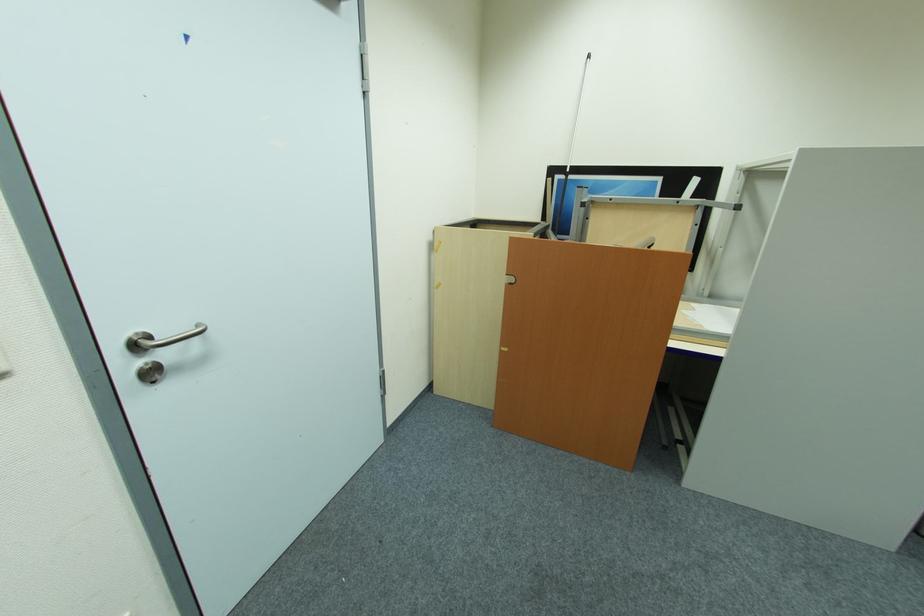
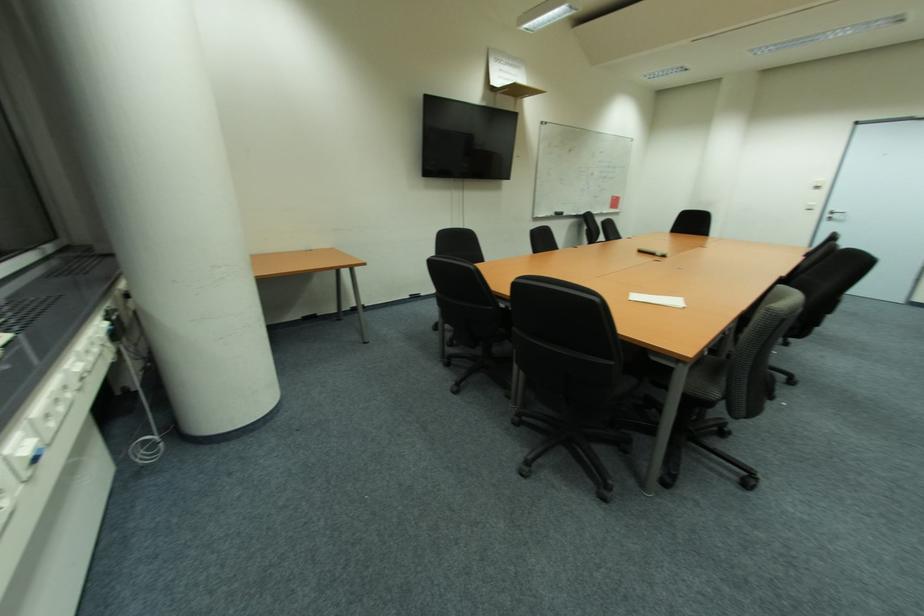
Locate, in the second image, the point that corresponds to point (169, 355) in the first image.

(842, 217)